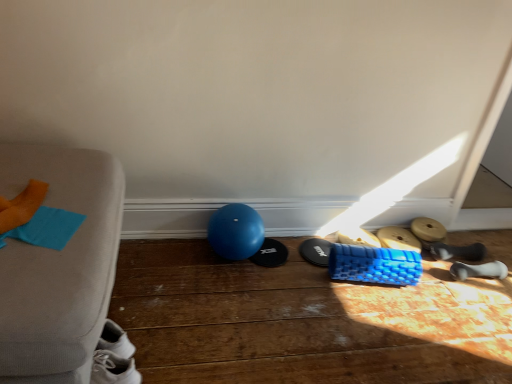
Find the location of `vacant space that's between blue rubber ball at center and blue textured foam roller at center, which is the third footwear in left-to-right order`. vacant space that's between blue rubber ball at center and blue textured foam roller at center, which is the third footwear in left-to-right order is located at coordinates (289, 255).